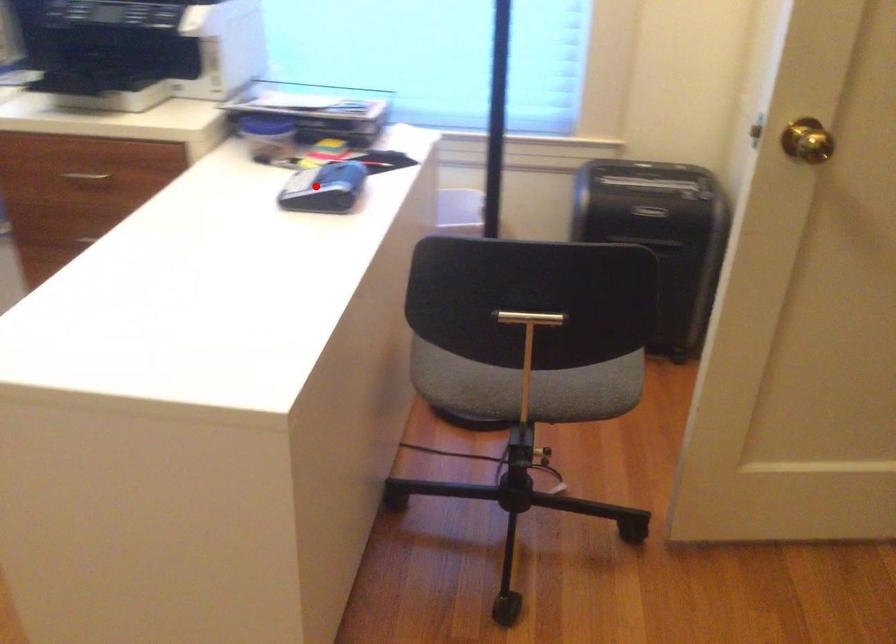
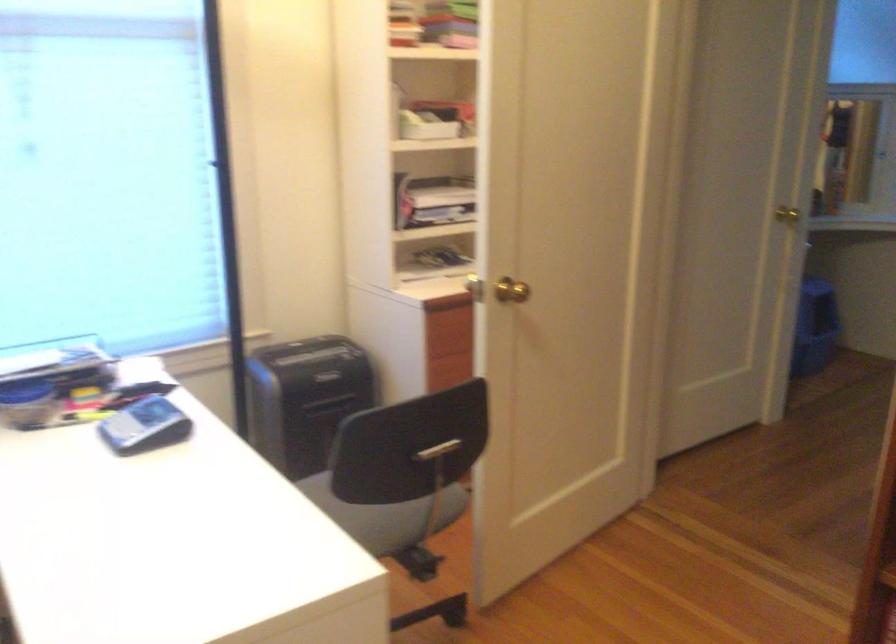
Question: I am providing you with two images of the same scene from different viewpoints. A red point is marked on the first image. Can you still see the location of the red point in image 2?

Choices:
 (A) Yes
 (B) No

Answer: (A)